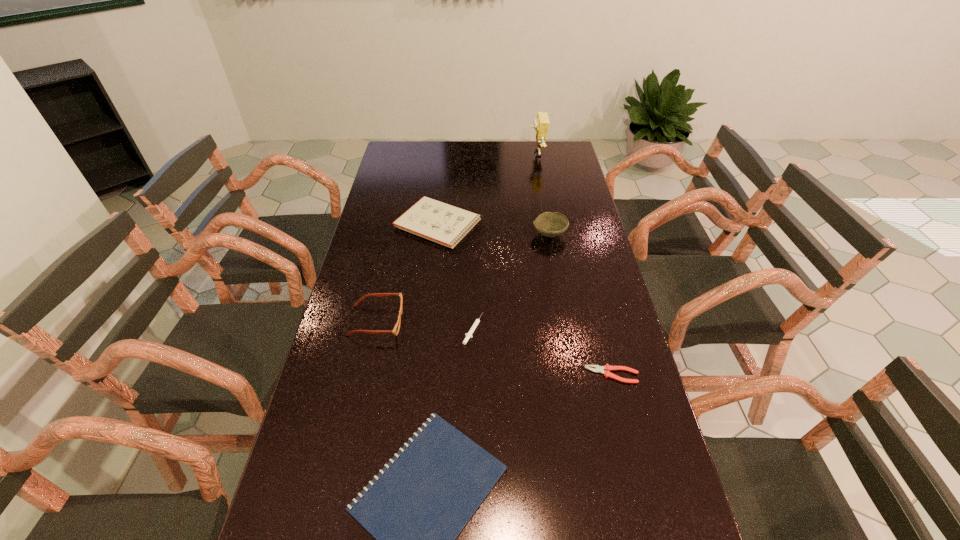
The width and height of the screenshot is (960, 540). I want to click on free space between the syringe and the spectacles, so click(x=424, y=325).

The height and width of the screenshot is (540, 960). I want to click on blank region between the bowl and the fifth shortest object, so click(x=463, y=278).

This screenshot has width=960, height=540. I want to click on free space between the bowl and the fourth tallest object, so click(494, 229).

The width and height of the screenshot is (960, 540). In order to click on vacant point located between the fourth tallest object and the sixth farthest object in this screenshot , I will do `click(525, 300)`.

Point out which object is positioned as the nearest to the pliers. Please provide its 2D coordinates. Your answer should be formatted as a tuple, i.e. [(x, y)], where the tuple contains the x and y coordinates of a point satisfying the conditions above.

[(416, 510)]

Point out which object is positioned as the second nearest to the second tallest object. Please provide its 2D coordinates. Your answer should be formatted as a tuple, i.e. [(x, y)], where the tuple contains the x and y coordinates of a point satisfying the conditions above.

[(468, 335)]

Locate an element on the screen. The image size is (960, 540). vacant area that satisfies the following two spatial constraints: 1. on the back side of the syringe; 2. on the left side of the sixth shortest object is located at coordinates (474, 234).

Where is `free space that satisfies the following two spatial constraints: 1. on the back side of the bowl; 2. on the right side of the syringe`? free space that satisfies the following two spatial constraints: 1. on the back side of the bowl; 2. on the right side of the syringe is located at coordinates (474, 234).